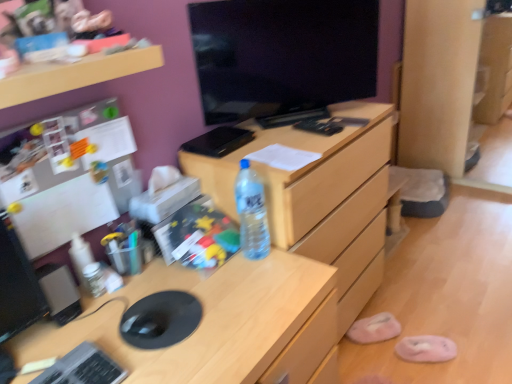
The height and width of the screenshot is (384, 512). I want to click on vacant region under wooden shelf at upper left (from a real-world perspective), so click(111, 286).